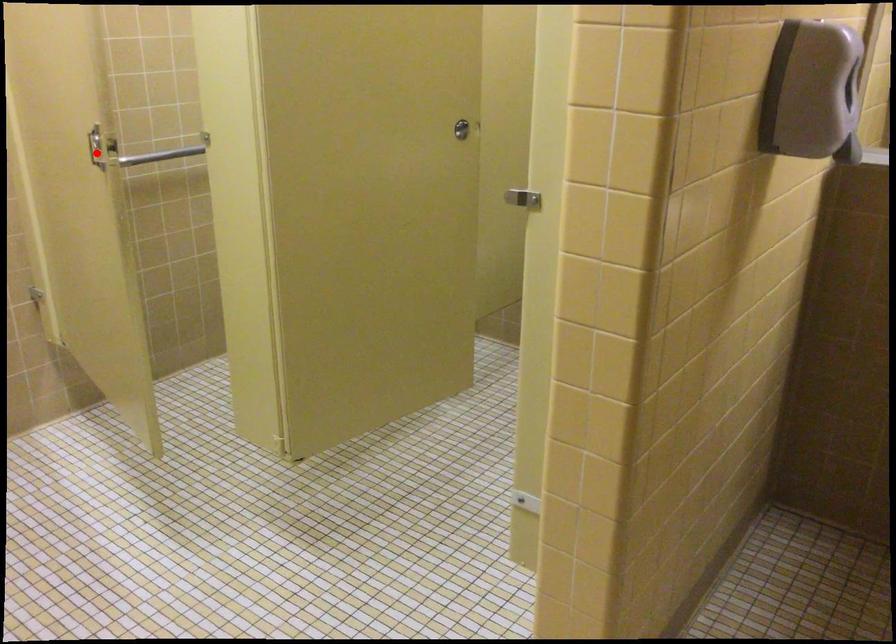
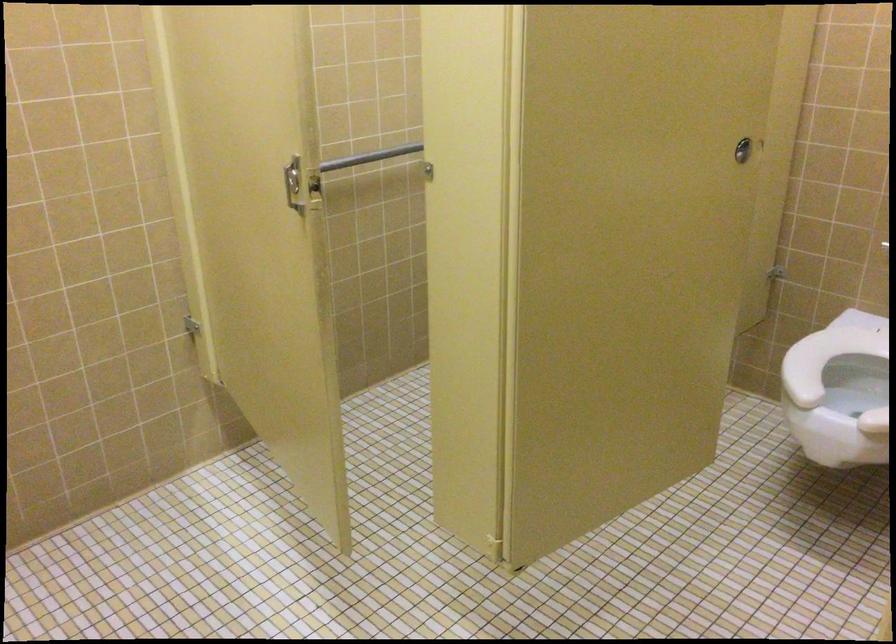
Question: I am providing you with two images of the same scene from different viewpoints. Image1 has a red point marked. In image2, the corresponding 3D location appears at what relative position? Reply with the corresponding letter.

Choices:
 (A) Closer
 (B) Farther

Answer: (A)